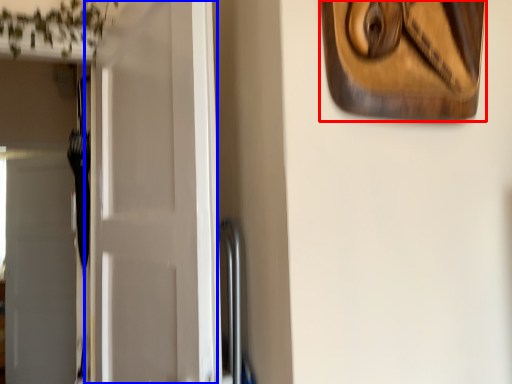
Question: Which object is further to the camera taking this photo, picture frame (highlighted by a red box) or door (highlighted by a blue box)?

Choices:
 (A) picture frame
 (B) door

Answer: (B)